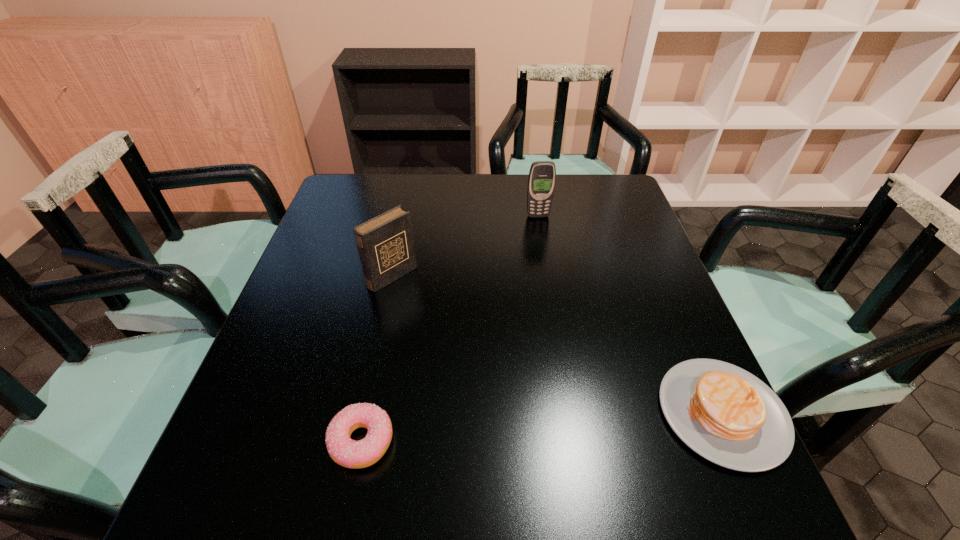
You are a GUI agent. You are given a task and a screenshot of the screen. Output one action in this format:
    pyautogui.click(x=<x>, y=<y>)
    Task: Click on the doughnut
    
    Given the screenshot: What is the action you would take?
    pyautogui.click(x=346, y=452)

Find the location of a particular element. the rightmost object is located at coordinates (725, 414).

The width and height of the screenshot is (960, 540). I want to click on pancake, so click(725, 414).

Locate an element on the screen. This screenshot has height=540, width=960. the third nearest object is located at coordinates (385, 243).

The height and width of the screenshot is (540, 960). Identify the location of the second object from right to left. (541, 182).

At what (x,y) coordinates should I click in order to perform the action: click on cellular telephone. Please return your answer as a coordinate pair (x, y). This screenshot has height=540, width=960. Looking at the image, I should click on (541, 182).

Find the location of a particular element. vacant space positioned on the right of the doughnut is located at coordinates (455, 441).

The height and width of the screenshot is (540, 960). Find the location of `vacant space located 0.120m on the back of the rightmost object`. vacant space located 0.120m on the back of the rightmost object is located at coordinates (681, 319).

You are a GUI agent. You are given a task and a screenshot of the screen. Output one action in this format:
    pyautogui.click(x=<x>, y=<y>)
    Task: Click on the vacant space situated on the front cover of the diary
    Image resolution: width=960 pixels, height=540 pixels.
    Given the screenshot: What is the action you would take?
    pyautogui.click(x=468, y=338)

Locate an element on the screen. The image size is (960, 540). vacant area located on the front cover of the diary is located at coordinates (462, 333).